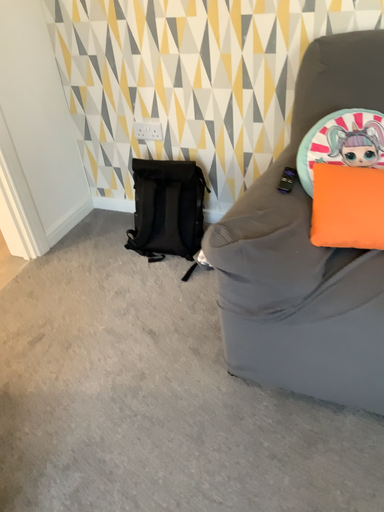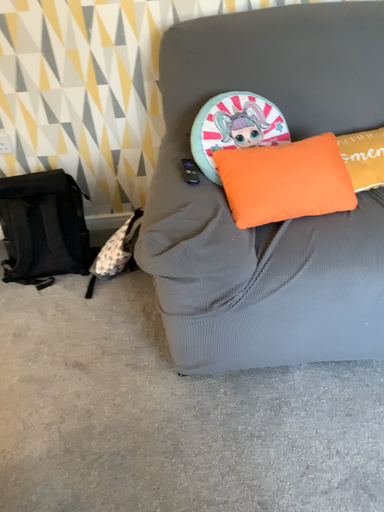
Question: Which way did the camera rotate in the video?

Choices:
 (A) rotated right
 (B) rotated left

Answer: (A)